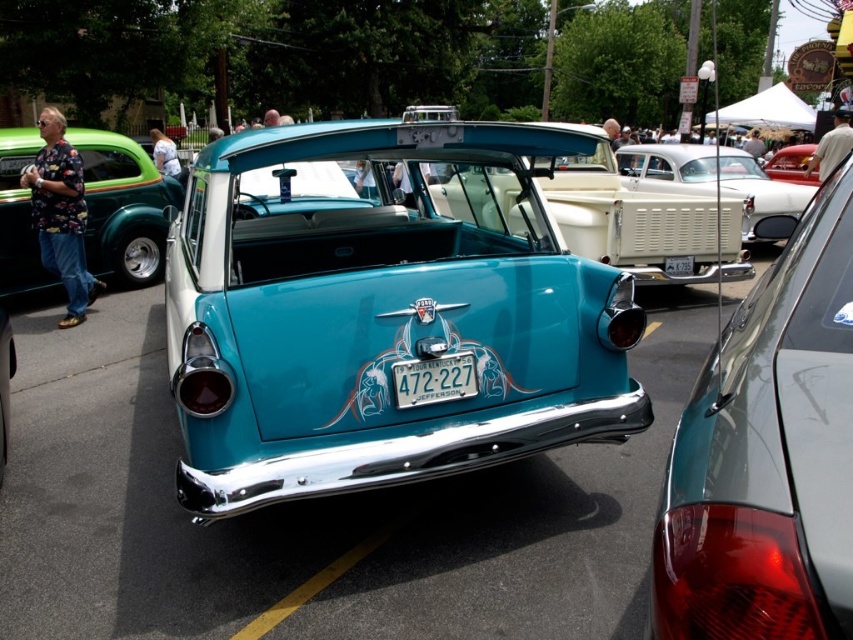
You are a photographer setting up for a car show. You have a camera with a lens that can capture objects up to 2 meters wide. You need to photograph both the glossy teal car at center and the blue metallic license plate at center. Can your camera lens accommodate the width of both objects without needing to adjust its settings?

The glossy teal car at center is wider than the blue metallic license plate at center. Since the car is wider than the license plate and the lens can capture up to 2 meters, you need to ensure the car itself is within the 2 meter limit. However, the description only states the car is wider than the plate, not the exact width. Without knowing the exact width of the car, it is uncertain if it fits within the lens capacity.

You are a photographer standing at the edge of the car show, and you want to take a photo that includes both the glossy teal car at center and the glossy metallic car at right. The minimum distance between the two cars that your camera can focus on is 8 feet. Will your camera be able to capture both cars in focus?

The glossy teal car at center and the glossy metallic car at right are 8.63 feet apart from each other. Since the minimum distance your camera can focus on is 8 feet, the 8.63 feet distance exceeds this requirement, so yes, the camera can capture both cars in focus.

You are a photographer planning to capture both the glossy metallic car at right and the shiny green car at left in a single frame. Given their sizes, which car should you position closer to the camera to ensure both appear proportionally balanced in the photo?

To ensure both cars appear proportionally balanced in the photo, you should position the glossy metallic car at right closer to the camera since it is smaller in size compared to the shiny green car at left.